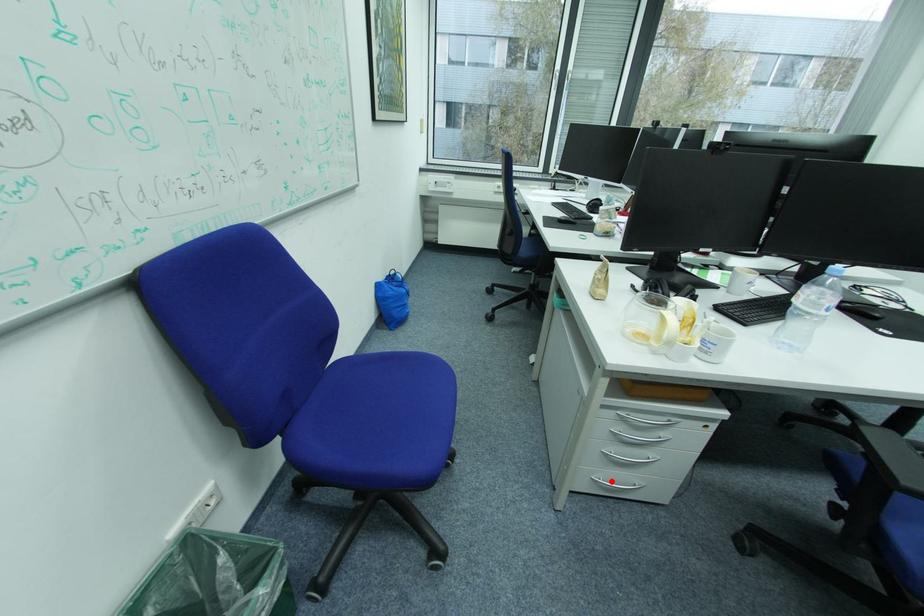
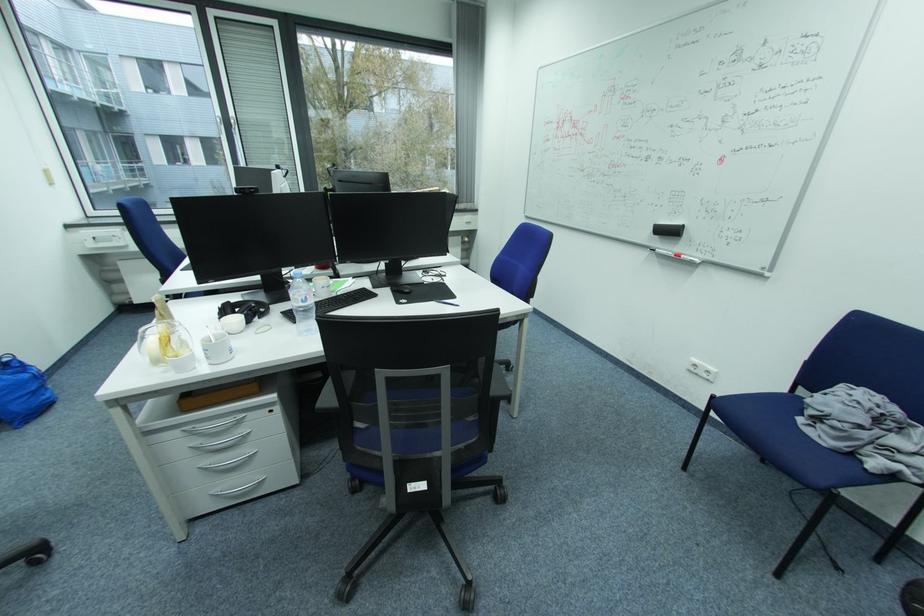
Question: I am providing you with two images of the same scene from different viewpoints. A red point is shown in image1. For the corresponding object point in image2, is it positioned nearer or farther from the camera?

Choices:
 (A) Nearer
 (B) Farther

Answer: (A)